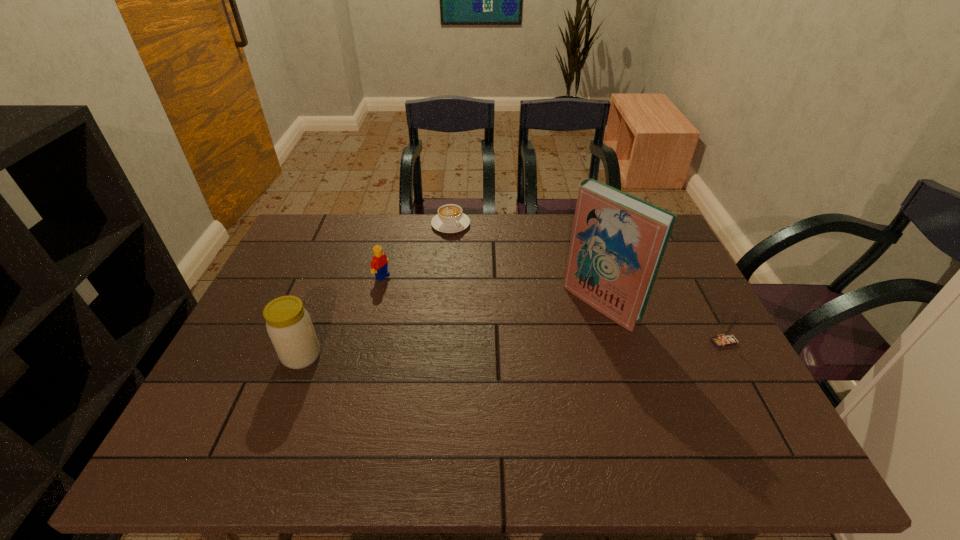
Locate an element on the screen. vacant space positioned 0.080m on the face of the Lego is located at coordinates (409, 291).

I want to click on vacant region located 0.220m on the face of the Lego, so click(447, 309).

I want to click on blank space located 0.130m on the face of the Lego, so click(422, 297).

Image resolution: width=960 pixels, height=540 pixels. In order to click on vacant space positioned 0.320m on the side of the shortest object with the handle in this screenshot , I will do `click(506, 292)`.

In order to click on vacant region located 0.310m on the side of the shortest object with the handle in this screenshot , I will do `click(505, 290)`.

Find the location of a particular element. The image size is (960, 540). vacant space located 0.130m on the side of the shortest object with the handle is located at coordinates (476, 256).

Locate an element on the screen. The image size is (960, 540). free space located on the cover of the fourth object from left to right is located at coordinates (520, 369).

The width and height of the screenshot is (960, 540). What are the coordinates of `vacant space located on the cover of the fourth object from left to right` in the screenshot? It's located at pyautogui.click(x=520, y=369).

This screenshot has width=960, height=540. I want to click on vacant space located 0.130m on the cover of the fourth object from left to right, so click(x=548, y=347).

At what (x,y) coordinates should I click in order to perform the action: click on object at the far edge. Please return your answer as a coordinate pair (x, y). Image resolution: width=960 pixels, height=540 pixels. Looking at the image, I should click on (450, 219).